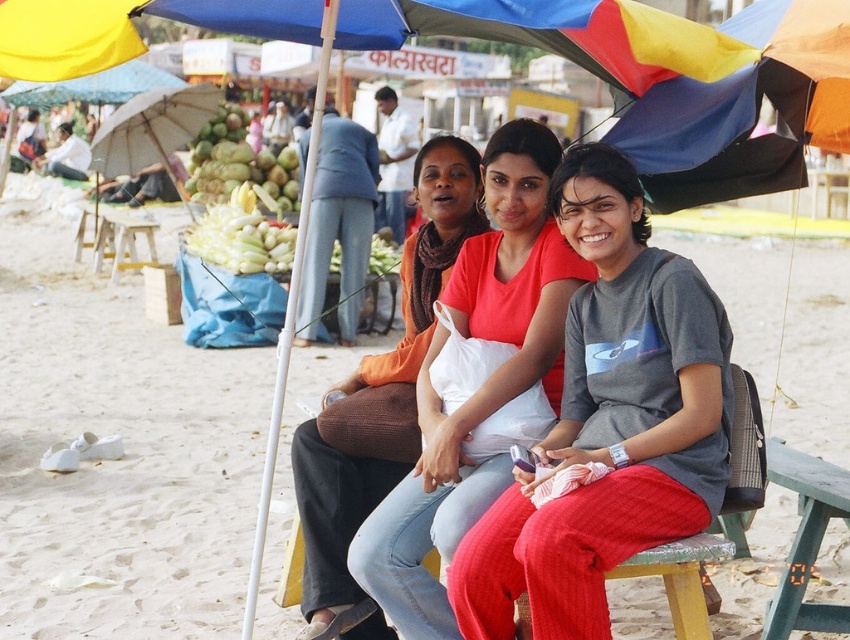
You are standing at the center of the image and want to walk towards the beige sand at lower center. Which direction should you move in?

You should move towards the lower center direction to reach the beige sand at lower center.

You are a vendor at the beach market and need to place a small decorative item. Which object, the beige sand at lower center or the brown fabric scarf at center, would be more suitable for placing the item to ensure it stays visible?

The beige sand at lower center has a larger size compared to the brown fabric scarf at center, so placing the small decorative item on the brown fabric scarf at center would make it more visible since the scarf has a smaller surface area.

You are a photographer standing at the beach market. You want to take a photo of the matte orange sweater at center and the yellow fabric canopy at upper left. Which object should you focus on first if you want to capture both in one shot without moving the camera?

The matte orange sweater at center is much taller than the yellow fabric canopy at upper left, so you should focus on the matte orange sweater at center first to ensure it is in focus before the canopy, as it occupies more vertical space in the frame.